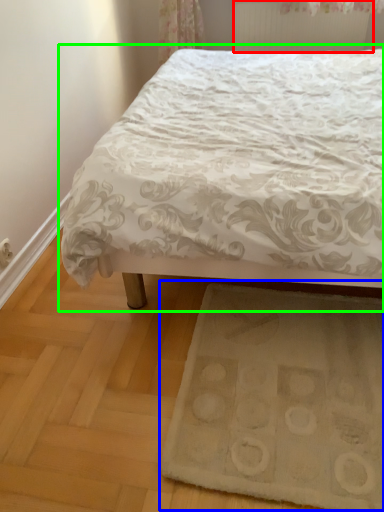
Question: Estimate the real-world distances between objects in this image. Which object is farther from radiator (highlighted by a red box), doormat (highlighted by a blue box) or bed (highlighted by a green box)?

Choices:
 (A) doormat
 (B) bed

Answer: (A)